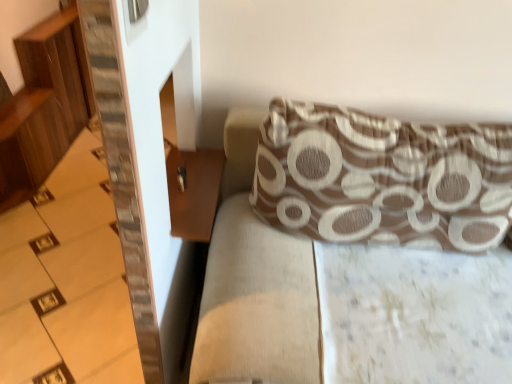
Question: From the image's perspective, is brown textured pillow at upper right on top of wooden stairs at left?

Choices:
 (A) yes
 (B) no

Answer: (A)

Question: Considering the relative sizes of brown textured pillow at upper right and wooden stairs at left in the image provided, is brown textured pillow at upper right thinner than wooden stairs at left?

Choices:
 (A) yes
 (B) no

Answer: (A)

Question: Does brown textured pillow at upper right turn towards wooden stairs at left?

Choices:
 (A) yes
 (B) no

Answer: (B)

Question: Considering the relative sizes of brown textured pillow at upper right and wooden stairs at left in the image provided, is brown textured pillow at upper right wider than wooden stairs at left?

Choices:
 (A) yes
 (B) no

Answer: (B)

Question: Would you say brown textured pillow at upper right is outside wooden stairs at left?

Choices:
 (A) yes
 (B) no

Answer: (A)

Question: In the image, is brown wooden table at lower left on the left side or the right side of brown textured pillow at upper right?

Choices:
 (A) left
 (B) right

Answer: (A)

Question: Considering the positions of brown wooden table at lower left and brown textured pillow at upper right in the image, is brown wooden table at lower left bigger or smaller than brown textured pillow at upper right?

Choices:
 (A) big
 (B) small

Answer: (B)

Question: From a real-world perspective, is brown wooden table at lower left positioned above or below brown textured pillow at upper right?

Choices:
 (A) below
 (B) above

Answer: (A)

Question: Is brown wooden table at lower left in front of or behind brown textured pillow at upper right in the image?

Choices:
 (A) behind
 (B) front

Answer: (A)

Question: Is brown textured cushion at upper right in front of or behind wooden stairs at left in the image?

Choices:
 (A) front
 (B) behind

Answer: (A)

Question: Considering the positions of brown textured cushion at upper right and wooden stairs at left in the image, is brown textured cushion at upper right wider or thinner than wooden stairs at left?

Choices:
 (A) thin
 (B) wide

Answer: (A)

Question: From a real-world perspective, is brown textured cushion at upper right physically located above or below wooden stairs at left?

Choices:
 (A) below
 (B) above

Answer: (B)

Question: Is brown textured cushion at upper right inside or outside of wooden stairs at left?

Choices:
 (A) inside
 (B) outside

Answer: (B)

Question: Does point (179, 167) appear closer or farther from the camera than point (114, 233)?

Choices:
 (A) closer
 (B) farther

Answer: (A)

Question: In the image, is brown wooden table at lower left positioned in front of or behind wooden stairs at left?

Choices:
 (A) front
 (B) behind

Answer: (A)